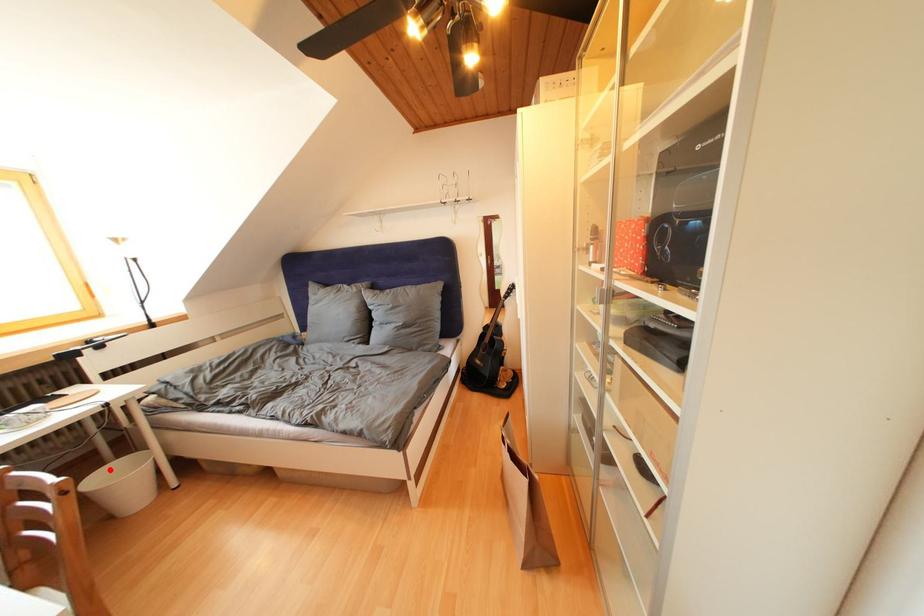
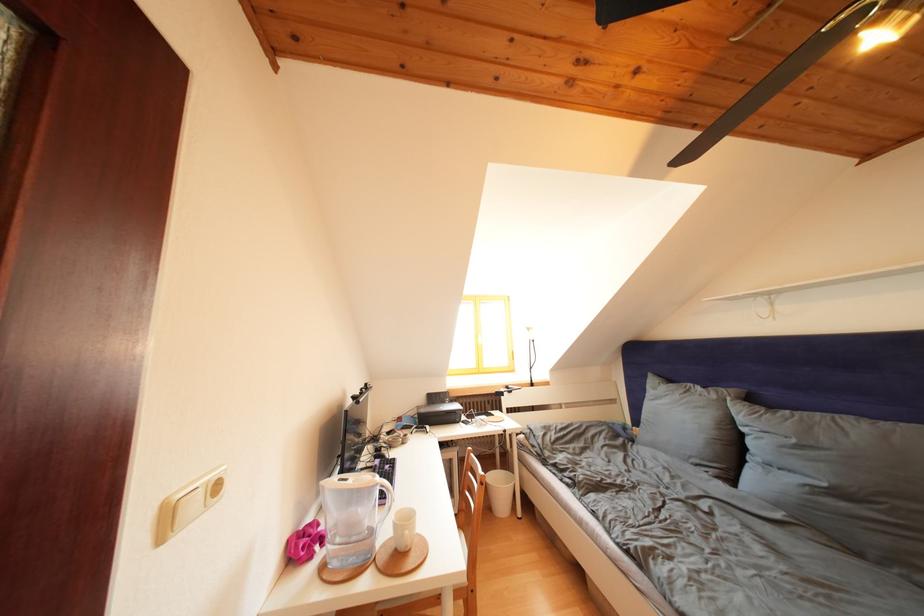
The point at the highlighted location is marked in the first image. Where is the corresponding point in the second image?

(503, 472)